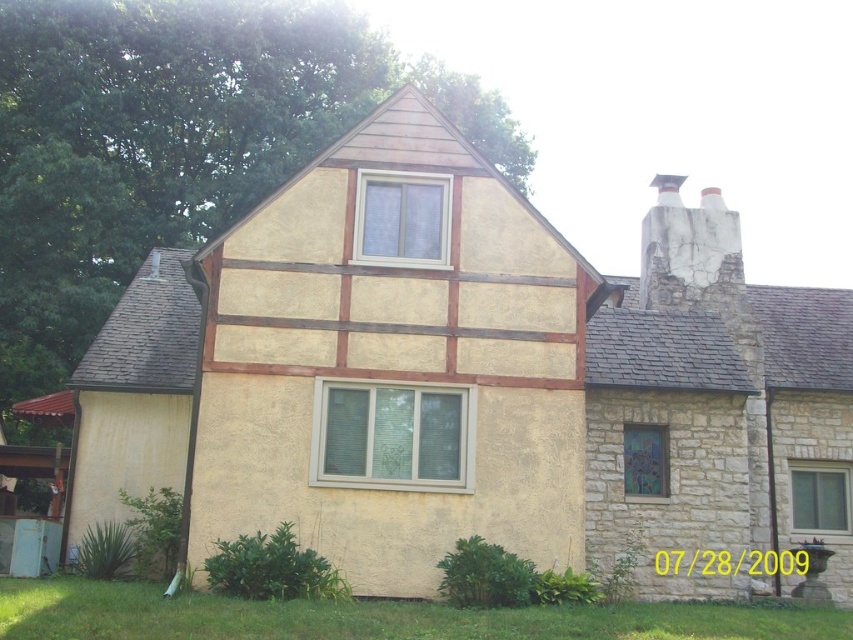
Which of these two, clear glass window at center or stained glass window at center-right, stands shorter?

stained glass window at center-right

Which is behind, point (410, 433) or point (624, 442)?

The point (624, 442) is behind.

Find the location of a particular element. This screenshot has width=853, height=640. clear glass window at center is located at coordinates (392, 436).

Does green grass at lower left have a lesser height compared to stained glass window at center-right?

No, green grass at lower left is not shorter than stained glass window at center-right.

Which of these two, green grass at lower left or stained glass window at center-right, stands shorter?

With less height is stained glass window at center-right.

Is point (764, 602) farther from camera compared to point (660, 432)?

No, it is in front of (660, 432).

At what (x,y) coordinates should I click in order to perform the action: click on green grass at lower left. Please return your answer as a coordinate pair (x, y). Looking at the image, I should click on point(380,618).

Which of these two, green grass at lower left or clear glass window at center, stands taller?

With more height is clear glass window at center.

Which is behind, point (850, 616) or point (384, 420)?

Point (384, 420)

Is point (19, 609) in front of point (325, 422)?

Yes, it is in front of point (325, 422).

You are a GUI agent. You are given a task and a screenshot of the screen. Output one action in this format:
    pyautogui.click(x=<x>, y=<y>)
    Task: Click on the green grass at lower left
    
    Given the screenshot: What is the action you would take?
    pyautogui.click(x=380, y=618)